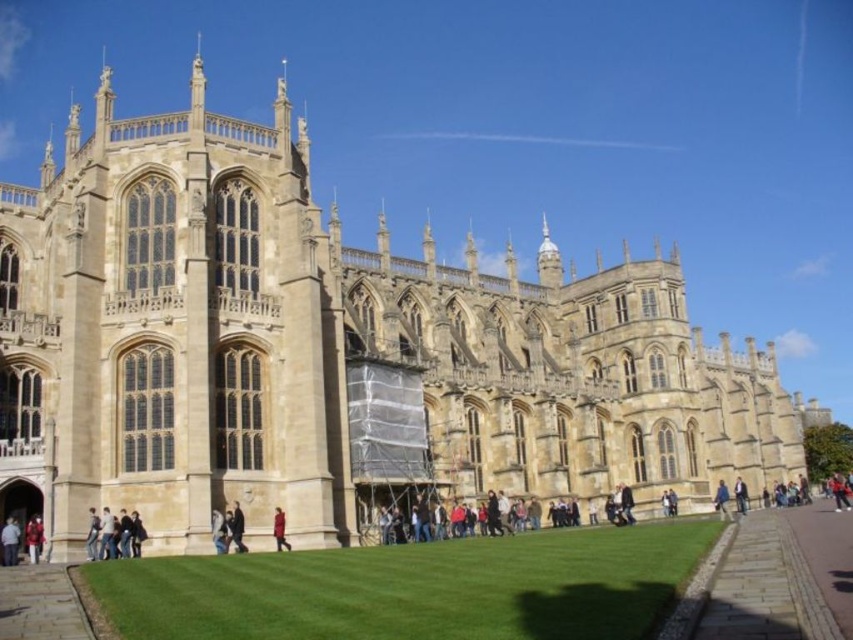
You are standing in front of the grand Gothic building and notice two jackets at the lower left corner. Which jacket is positioned more to the left between the light brown leather jacket at lower left and the red jacket at lower left?

The light brown leather jacket at lower left is positioned more to the left compared to the red jacket at lower left.

You are a photographer standing at the base of the Gothic building. You want to capture both the red fabric coat at lower center and the blue fabric jacket at lower right in the same frame. Given the distance between them, will you be able to include both in your shot without moving your position?

The red fabric coat at lower center and blue fabric jacket at lower right are 37.06 meters apart. At this distance, capturing both in the same frame without moving position would be challenging unless using a wide angle lens. However, standard lenses might struggle to encompass such a large separation.